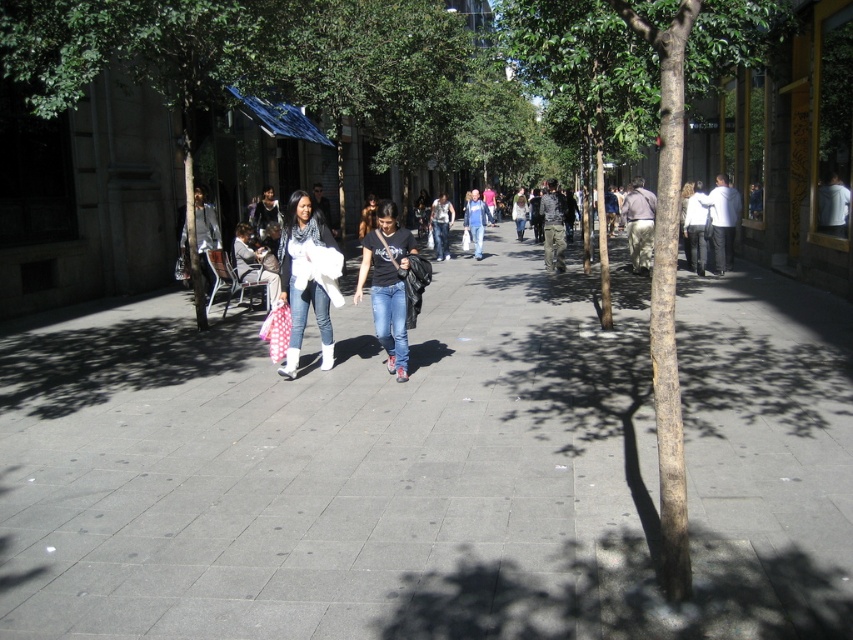
You are standing in the middle of the bustling urban street scene. There are two points marked in the image, one at coordinate point (389, 621) and another at point (392, 333). Which point is closer to you?

Point (389, 621) is closer to the camera than point (392, 333), so the point at (389, 621) is closer to you.